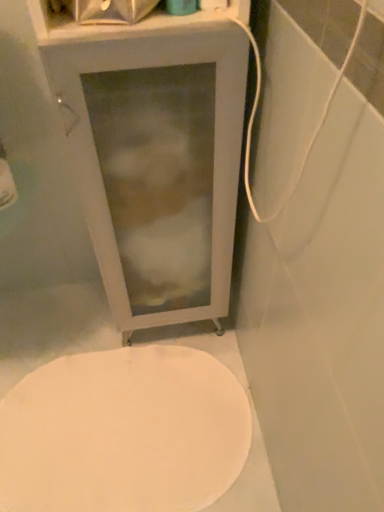
What are the coordinates of `vacant space situated above white matte toilet at lower center (from a real-world perspective)` in the screenshot? It's located at (126, 429).